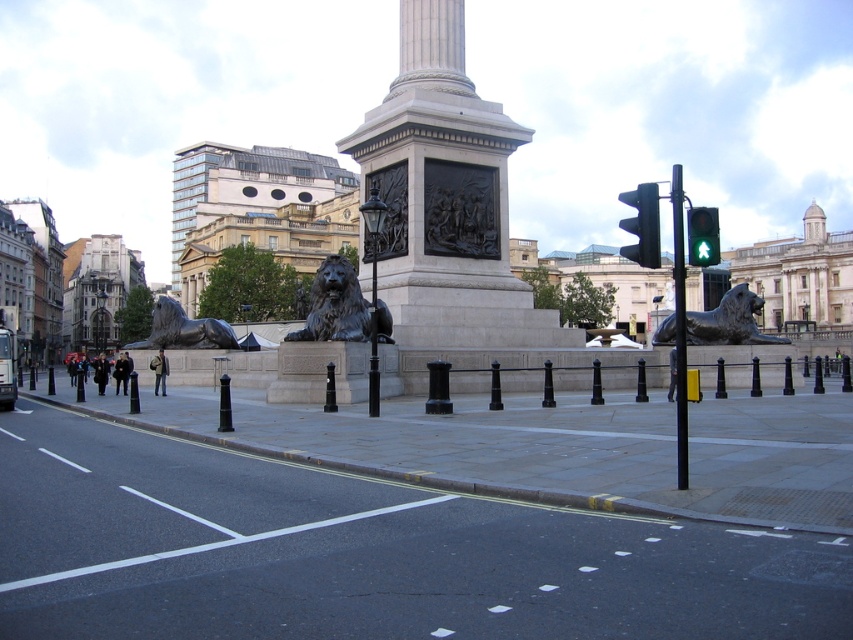
You are a city planner assessing the safety of the pedestrian crossing near the monument. The bronze lion at left and the black polished stone post at center are both located near the crossing. Which object is more likely to obstruct the view of pedestrians looking towards the traffic light on the right?

The bronze lion at left is taller than the black polished stone post at center, so it is more likely to obstruct the view of pedestrians looking towards the traffic light on the right.

You are a pedestrian standing at the crosswalk in front of the monument. You want to cross the road to the traffic light on the right. Which direction should you walk to avoid the shiny silver lion at right?

The shiny silver lion at right is located at point (729, 321). To avoid it, you should walk towards the traffic light on the right while staying to the left side of the crosswalk to bypass the lion positioned on the right side.